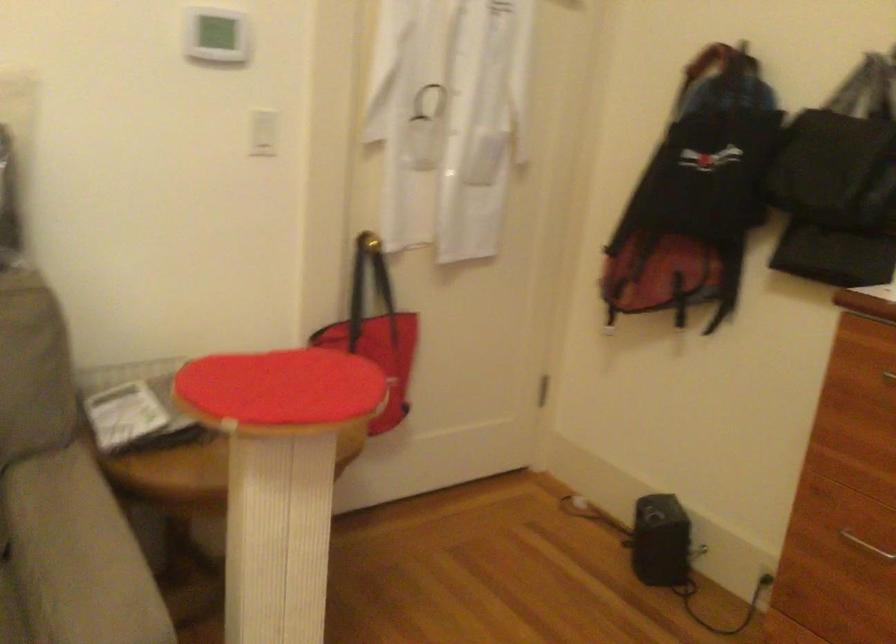
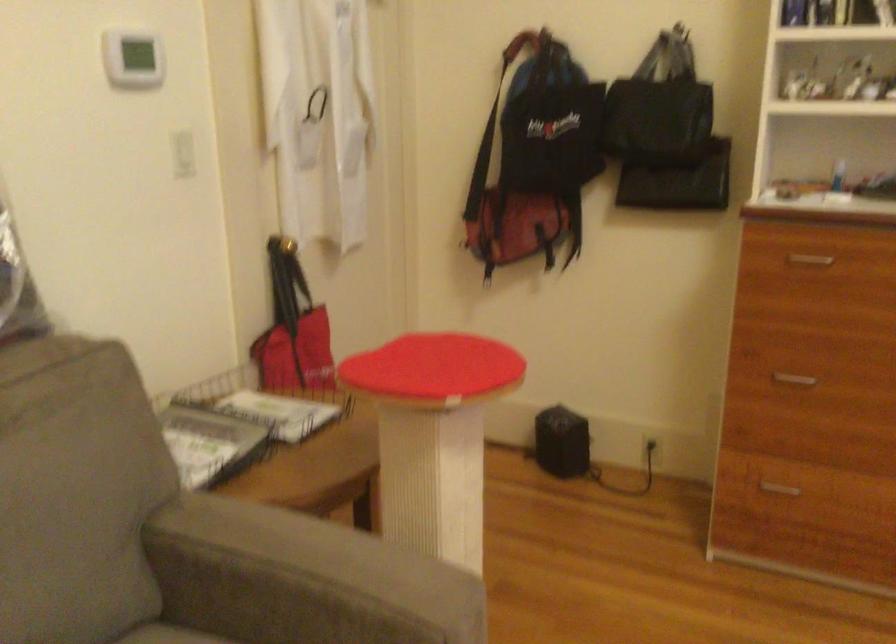
Question: The images are taken continuously from a first-person perspective. In which direction are you moving?

Choices:
 (A) Left
 (B) Right
 (C) Forward
 (D) Backward

Answer: (A)